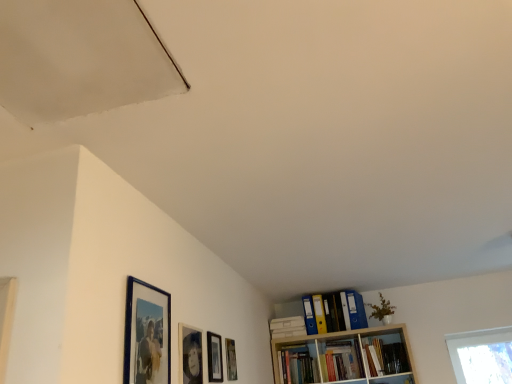
At what (x,y) coordinates should I click in order to perform the action: click on smooth white exhaust hood at upper left. Please return your answer as a coordinate pair (x, y). Looking at the image, I should click on (80, 58).

What is the approximate height of blue glossy picture frame at upper left, marked as the first picture frame in a left-to-right arrangement?

It is 42.07 centimeters.

The width and height of the screenshot is (512, 384). What are the coordinates of `yellow file folder at upper right, placed as the 1th book when sorted from left to right` in the screenshot? It's located at (343, 311).

Is yellow file folder at upper right, placed as the 1th book when sorted from left to right, beside smooth white exhaust hood at upper left?

They are not placed beside each other.

How different are the orientations of yellow file folder at upper right, marked as the 2th book in a right-to-left arrangement, and smooth white exhaust hood at upper left in degrees?

The facing directions of yellow file folder at upper right, marked as the 2th book in a right-to-left arrangement, and smooth white exhaust hood at upper left are 90.7 degrees apart.

Is smooth white exhaust hood at upper left located within yellow file folder at upper right, marked as the 2th book in a right-to-left arrangement?

No, smooth white exhaust hood at upper left is located outside of yellow file folder at upper right, marked as the 2th book in a right-to-left arrangement.

Considering the sizes of yellow file folder at upper right, marked as the 2th book in a right-to-left arrangement, and smooth white exhaust hood at upper left in the image, is yellow file folder at upper right, marked as the 2th book in a right-to-left arrangement, wider or thinner than smooth white exhaust hood at upper left?

Considering their sizes, yellow file folder at upper right, marked as the 2th book in a right-to-left arrangement, looks slimmer than smooth white exhaust hood at upper left.

From the image's perspective, is matte black picture frame at center, placed as the second picture frame when sorted from back to front, under hardcover book at upper right, which is the 1th book from right to left?

Incorrect, from the image's perspective, matte black picture frame at center, placed as the second picture frame when sorted from back to front, is higher than hardcover book at upper right, which is the 1th book from right to left.

Does matte black picture frame at center, placed as the third picture frame when sorted from front to back, have a greater width compared to hardcover book at upper right, marked as the 2th book in a left-to-right arrangement?

No.

Is matte black picture frame at center, placed as the third picture frame when sorted from front to back, to the left of hardcover book at upper right, marked as the 2th book in a left-to-right arrangement, from the viewer's perspective?

Indeed, matte black picture frame at center, placed as the third picture frame when sorted from front to back, is positioned on the left side of hardcover book at upper right, marked as the 2th book in a left-to-right arrangement.

Is smooth white exhaust hood at upper left facing away from matte wooden picture frame at lower center, placed as the first picture frame when sorted from right to left?

No, smooth white exhaust hood at upper left's orientation is not away from matte wooden picture frame at lower center, placed as the first picture frame when sorted from right to left.

From the image's perspective, is smooth white exhaust hood at upper left located above matte wooden picture frame at lower center, placed as the first picture frame when sorted from right to left?

Yes, from the image's perspective, smooth white exhaust hood at upper left is on top of matte wooden picture frame at lower center, placed as the first picture frame when sorted from right to left.

Considering the relative sizes of smooth white exhaust hood at upper left and matte wooden picture frame at lower center, placed as the first picture frame when sorted from right to left, in the image provided, is smooth white exhaust hood at upper left thinner than matte wooden picture frame at lower center, placed as the first picture frame when sorted from right to left,?

In fact, smooth white exhaust hood at upper left might be wider than matte wooden picture frame at lower center, placed as the first picture frame when sorted from right to left.

Which object is positioned more to the left, smooth white exhaust hood at upper left or matte wooden picture frame at lower center, the 4th picture frame viewed from the front?

smooth white exhaust hood at upper left.

Who is more distant, blue glossy picture frame at upper left, acting as the 1th picture frame starting from the front, or yellow file folder at upper right, placed as the 1th book when sorted from left to right?

yellow file folder at upper right, placed as the 1th book when sorted from left to right, is further from the camera.

Which object is wider, blue glossy picture frame at upper left, the fourth picture frame in the back-to-front sequence, or yellow file folder at upper right, marked as the 2th book in a right-to-left arrangement?

With larger width is yellow file folder at upper right, marked as the 2th book in a right-to-left arrangement.

Could yellow file folder at upper right, placed as the 1th book when sorted from left to right, be considered to be inside blue glossy picture frame at upper left, the fourth picture frame in the back-to-front sequence?

That's incorrect, yellow file folder at upper right, placed as the 1th book when sorted from left to right, is not inside blue glossy picture frame at upper left, the fourth picture frame in the back-to-front sequence.

In terms of size, does blue glossy picture frame at upper left, which is the 4th picture frame from right to left, appear bigger or smaller than yellow file folder at upper right, placed as the 1th book when sorted from left to right?

Clearly, blue glossy picture frame at upper left, which is the 4th picture frame from right to left, is smaller in size than yellow file folder at upper right, placed as the 1th book when sorted from left to right.

Which is less distant, (183, 361) or (220, 377)?

Point (183, 361).

From the image's perspective, which is below, matte black picture frame at lower center, arranged as the 3th picture frame when viewed from the right, or matte black picture frame at center, placed as the second picture frame when sorted from back to front?

matte black picture frame at center, placed as the second picture frame when sorted from back to front, appears lower in the image.

Where is `the 1st picture frame to the left of the matte black picture frame at center, which is counted as the 2th picture frame, starting from the right, counting from the anchor's position`? This screenshot has height=384, width=512. the 1st picture frame to the left of the matte black picture frame at center, which is counted as the 2th picture frame, starting from the right, counting from the anchor's position is located at coordinates (190, 355).

Would you say smooth white exhaust hood at upper left is part of matte wooden picture frame at lower center, marked as the 4th picture frame in a left-to-right arrangement,'s contents?

No, smooth white exhaust hood at upper left is not inside matte wooden picture frame at lower center, marked as the 4th picture frame in a left-to-right arrangement.

Can you confirm if matte wooden picture frame at lower center, placed as the first picture frame when sorted from right to left, is thinner than smooth white exhaust hood at upper left?

Indeed, matte wooden picture frame at lower center, placed as the first picture frame when sorted from right to left, has a lesser width compared to smooth white exhaust hood at upper left.

From a real-world perspective, which is physically below, matte wooden picture frame at lower center, which ranks as the first picture frame in back-to-front order, or smooth white exhaust hood at upper left?

In real-world perspective, matte wooden picture frame at lower center, which ranks as the first picture frame in back-to-front order, is lower.

Does matte wooden picture frame at lower center, placed as the first picture frame when sorted from right to left, appear on the right side of smooth white exhaust hood at upper left?

Yes.

From the image's perspective, is matte black picture frame at lower center, the 2th picture frame from the front, on matte wooden picture frame at lower center, the 4th picture frame viewed from the front?

Yes, from the image's perspective, matte black picture frame at lower center, the 2th picture frame from the front, is above matte wooden picture frame at lower center, the 4th picture frame viewed from the front.

From the image's perspective, count 2nd picture frames upward from the matte wooden picture frame at lower center, marked as the 4th picture frame in a left-to-right arrangement, and point to it. Please provide its 2D coordinates.

[(190, 355)]

Considering the relative sizes of matte black picture frame at lower center, arranged as the 3th picture frame when viewed from the right, and matte wooden picture frame at lower center, the 4th picture frame viewed from the front, in the image provided, is matte black picture frame at lower center, arranged as the 3th picture frame when viewed from the right, shorter than matte wooden picture frame at lower center, the 4th picture frame viewed from the front,?

No, matte black picture frame at lower center, arranged as the 3th picture frame when viewed from the right, is not shorter than matte wooden picture frame at lower center, the 4th picture frame viewed from the front.

The width and height of the screenshot is (512, 384). Identify the location of the 1st book directly beneath the smooth white exhaust hood at upper left (from a real-world perspective). (343, 311).

Starting from the hardcover book at upper right, which is the 1th book from right to left, which picture frame is the 2nd one to the left? Please provide its 2D coordinates.

[(214, 357)]

Estimate the real-world distances between objects in this image. Which object is further from matte black picture frame at center, placed as the second picture frame when sorted from back to front, yellow file folder at upper right, marked as the 2th book in a right-to-left arrangement, or smooth white exhaust hood at upper left?

The object further to matte black picture frame at center, placed as the second picture frame when sorted from back to front, is smooth white exhaust hood at upper left.

When comparing their distances from matte wooden picture frame at lower center, the 4th picture frame viewed from the front, does blue glossy picture frame at upper left, which is the 4th picture frame from right to left, or matte black picture frame at lower center, which is the second picture frame from left to right, seem further?

blue glossy picture frame at upper left, which is the 4th picture frame from right to left, is further to matte wooden picture frame at lower center, the 4th picture frame viewed from the front.

Looking at the image, which one is located further to hardcover book at upper right, which is the 1th book from right to left, blue glossy picture frame at upper left, which is the 4th picture frame from right to left, or matte black picture frame at lower center, placed as the third picture frame when sorted from back to front?

blue glossy picture frame at upper left, which is the 4th picture frame from right to left, lies further to hardcover book at upper right, which is the 1th book from right to left, than the other object.

Looking at the image, which one is located further to matte black picture frame at center, the 3th picture frame from the left, matte wooden picture frame at lower center, placed as the first picture frame when sorted from right to left, or smooth white exhaust hood at upper left?

Among the two, smooth white exhaust hood at upper left is located further to matte black picture frame at center, the 3th picture frame from the left.

When comparing their distances from matte black picture frame at center, which is counted as the 2th picture frame, starting from the right, does matte black picture frame at lower center, placed as the third picture frame when sorted from back to front, or hardcover book at upper right, marked as the 2th book in a left-to-right arrangement, seem closer?

matte black picture frame at lower center, placed as the third picture frame when sorted from back to front.

Which object lies nearer to the anchor point blue glossy picture frame at upper left, the fourth picture frame in the back-to-front sequence, yellow file folder at upper right, placed as the 1th book when sorted from left to right, or matte black picture frame at center, which is counted as the 2th picture frame, starting from the right?

matte black picture frame at center, which is counted as the 2th picture frame, starting from the right, is closer to blue glossy picture frame at upper left, the fourth picture frame in the back-to-front sequence.

From the image, which object appears to be farther from matte wooden picture frame at lower center, the 4th picture frame viewed from the front, hardcover book at upper right, marked as the 2th book in a left-to-right arrangement, or matte black picture frame at center, placed as the third picture frame when sorted from front to back?

hardcover book at upper right, marked as the 2th book in a left-to-right arrangement, lies further to matte wooden picture frame at lower center, the 4th picture frame viewed from the front, than the other object.

From the image, which object appears to be farther from yellow file folder at upper right, placed as the 1th book when sorted from left to right, smooth white exhaust hood at upper left or hardcover book at upper right, which is the 1th book from right to left?

The object further to yellow file folder at upper right, placed as the 1th book when sorted from left to right, is smooth white exhaust hood at upper left.

The height and width of the screenshot is (384, 512). Identify the location of picture frame between blue glossy picture frame at upper left, the fourth picture frame in the back-to-front sequence, and matte black picture frame at center, placed as the second picture frame when sorted from back to front, from front to back. (190, 355).

The height and width of the screenshot is (384, 512). I want to click on picture frame located between matte black picture frame at lower center, placed as the third picture frame when sorted from back to front, and matte wooden picture frame at lower center, the 4th picture frame viewed from the front, in the depth direction, so click(214, 357).

At what (x,y) coordinates should I click in order to perform the action: click on book positioned between matte black picture frame at center, which is counted as the 2th picture frame, starting from the right, and yellow file folder at upper right, marked as the 2th book in a right-to-left arrangement, from near to far. Please return your answer as a coordinate pair (x, y). The image size is (512, 384). Looking at the image, I should click on (386, 357).

You are a GUI agent. You are given a task and a screenshot of the screen. Output one action in this format:
    pyautogui.click(x=<x>, y=<y>)
    Task: Click on the picture frame between smooth white exhaust hood at upper left and matte black picture frame at lower center, the 2th picture frame from the front, vertically
    This screenshot has width=512, height=384.
    Given the screenshot: What is the action you would take?
    pyautogui.click(x=147, y=334)